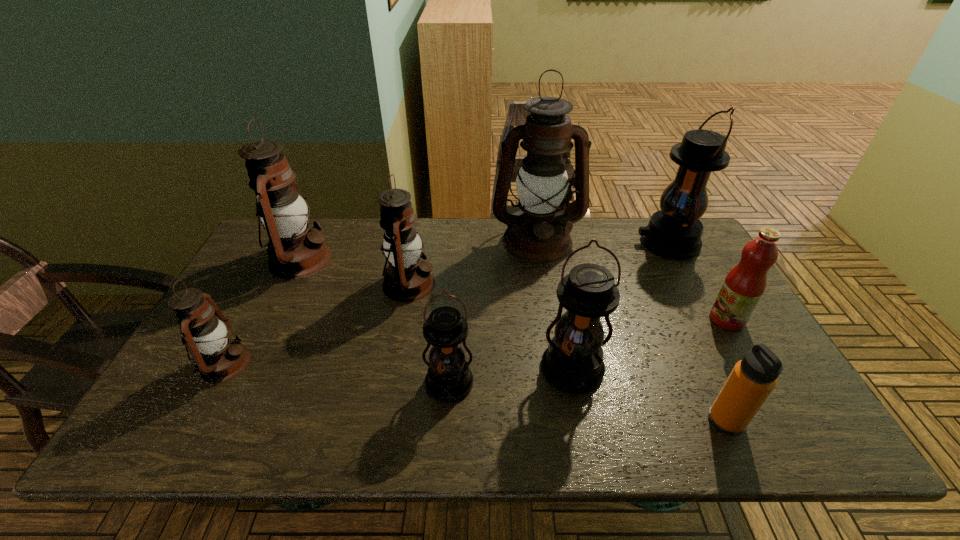
You are a GUI agent. You are given a task and a screenshot of the screen. Output one action in this format:
    pyautogui.click(x=<x>, y=<y>)
    Task: Click on the fourth lantern from right to left
    The height and width of the screenshot is (540, 960).
    Given the screenshot: What is the action you would take?
    pyautogui.click(x=449, y=379)

Find the location of a particular element. the sixth object from right to left is located at coordinates (449, 379).

You are a GUI agent. You are given a task and a screenshot of the screen. Output one action in this format:
    pyautogui.click(x=<x>, y=<y>)
    Task: Click on the shortest object
    
    Given the screenshot: What is the action you would take?
    coord(753,378)

Locate an element on the screen. Image resolution: width=960 pixels, height=540 pixels. orange thermos bottle is located at coordinates (753, 378).

I want to click on vacant area located 0.190m on the side of the rightmost brown lantern, there is a wick adjustment knob, so click(548, 305).

Find a few locations in the blank space located 0.300m above the rightmost lantern, indicating its light source. Please provide its 2D coordinates. Your answer should be formatted as a tuple, i.e. [(x, y)], where the tuple contains the x and y coordinates of a point satisfying the conditions above.

[(546, 242)]

Choose a point located above the rightmost lantern, indicating its light source in the vacant region. Please provide its 2D coordinates. Your answer should be formatted as a tuple, i.e. [(x, y)], where the tuple contains the x and y coordinates of a point satisfying the conditions above.

[(570, 242)]

Identify a few spots in the free region located 0.180m above the rightmost lantern, indicating its light source. Please provide its 2D coordinates. Your answer should be formatted as a tuple, i.e. [(x, y)], where the tuple contains the x and y coordinates of a point satisfying the conditions above.

[(582, 242)]

Find the location of a particular element. vacant region located 0.080m on the side of the third smallest brown lantern, there is a wick adjustment knob is located at coordinates (356, 259).

I want to click on vacant space situated on the side of the seventh object from right to left, there is a wick adjustment knob, so coord(519,284).